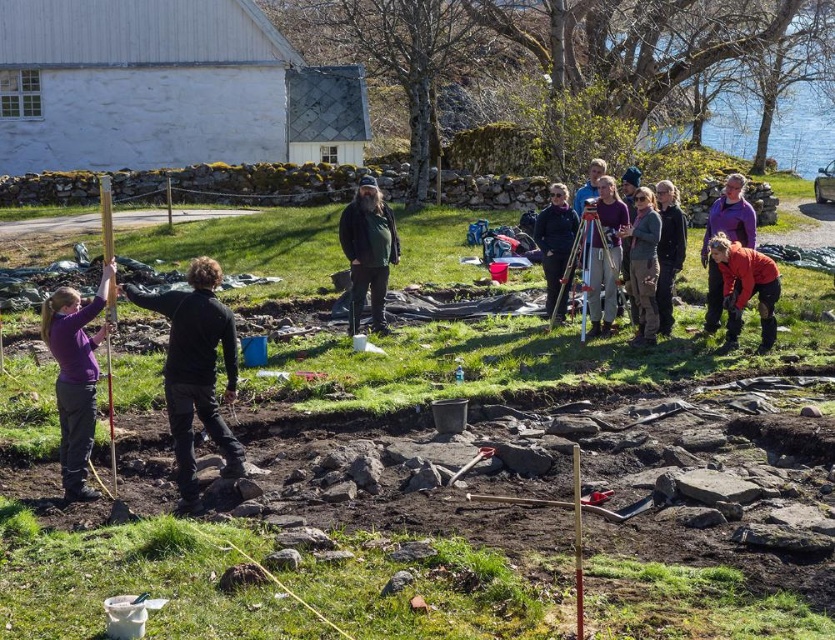
You are a photographer standing at the edge of an archaeological excavation site. You need to take a photo of the dark blue jacket at center without the purple matte tripod at center appearing in the frame. Given that your camera has a field of view of 24 inches, can you position yourself appropriately to achieve this?

The distance between the purple matte tripod at center and the dark blue jacket at center is 27.83 inches. Since your camera has a field of view of 24 inches, you can move sideways so that the 24 inch field of view only captures the dark blue jacket at center while excluding the purple matte tripod at center, as the total distance between them is greater than the field of view.